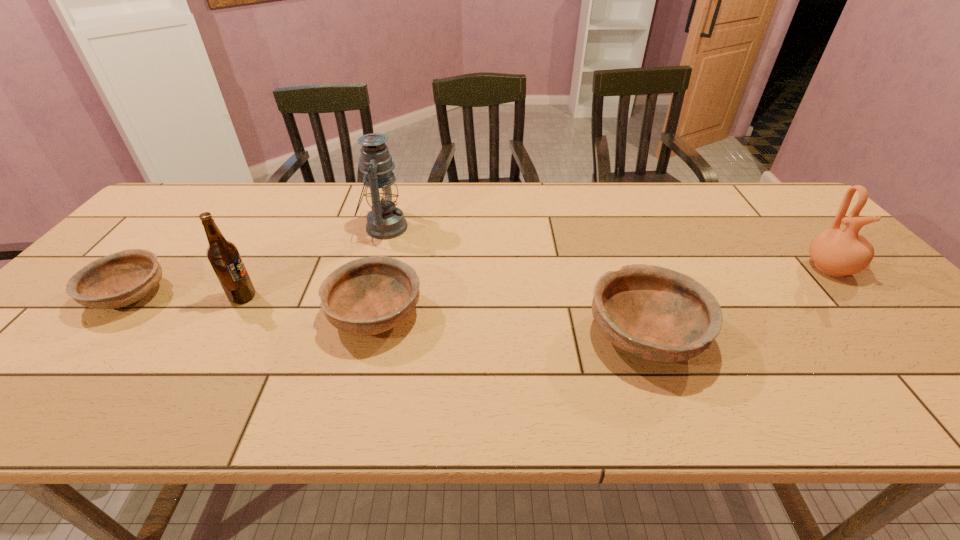
This screenshot has height=540, width=960. In order to click on the shortest bowl in this screenshot , I will do `click(122, 278)`.

Where is `the leftmost bowl`? the leftmost bowl is located at coordinates (122, 278).

Image resolution: width=960 pixels, height=540 pixels. Identify the location of the second bowl from left to right. (367, 296).

The image size is (960, 540). Find the location of `the second tallest bowl`. the second tallest bowl is located at coordinates (367, 296).

At what (x,y) coordinates should I click in order to perform the action: click on the second object from right to left. Please return your answer as a coordinate pair (x, y). Looking at the image, I should click on (658, 314).

At what (x,y) coordinates should I click in order to perform the action: click on the tallest object. Please return your answer as a coordinate pair (x, y). This screenshot has height=540, width=960. Looking at the image, I should click on (385, 221).

Where is `lantern`? lantern is located at coordinates (385, 221).

At what (x,y) coordinates should I click in order to perform the action: click on pottery. Please return your answer as a coordinate pair (x, y). Looking at the image, I should click on (836, 252).

At what (x,y) coordinates should I click in order to perform the action: click on beer bottle. Please return your answer as a coordinate pair (x, y). Looking at the image, I should click on (223, 255).

Identify the location of vacant space located 0.110m on the right of the shortest object. (211, 296).